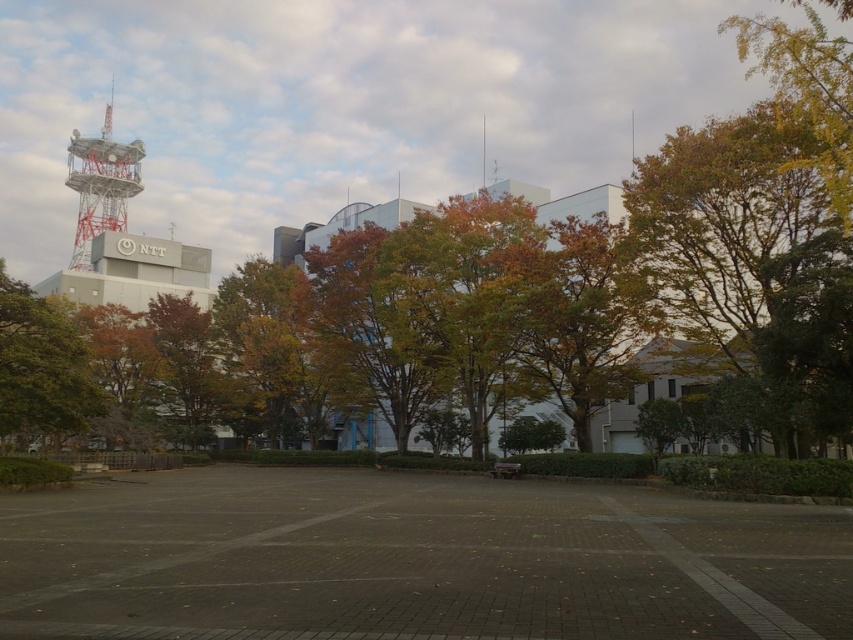
You are standing in the urban scene and want to take a photo of the gray concrete parking lot at center and the green leafy tree at left. Which object will appear larger in the photo if you focus on them both equally?

The green leafy tree at left will appear larger in the photo because it is taller than the gray concrete parking lot at center.

You are standing on the gray concrete parking lot at center and want to walk towards the metallic lattice tower at upper left. Is the tower behind or in front of the parking lot?

The gray concrete parking lot at center is in front of the metallic lattice tower at upper left, so the tower is behind the parking lot.